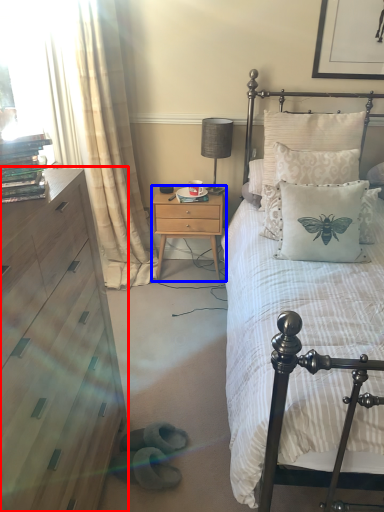
Question: Which point is further to the camera, chest of drawers (highlighted by a red box) or nightstand (highlighted by a blue box)?

Choices:
 (A) chest of drawers
 (B) nightstand

Answer: (B)